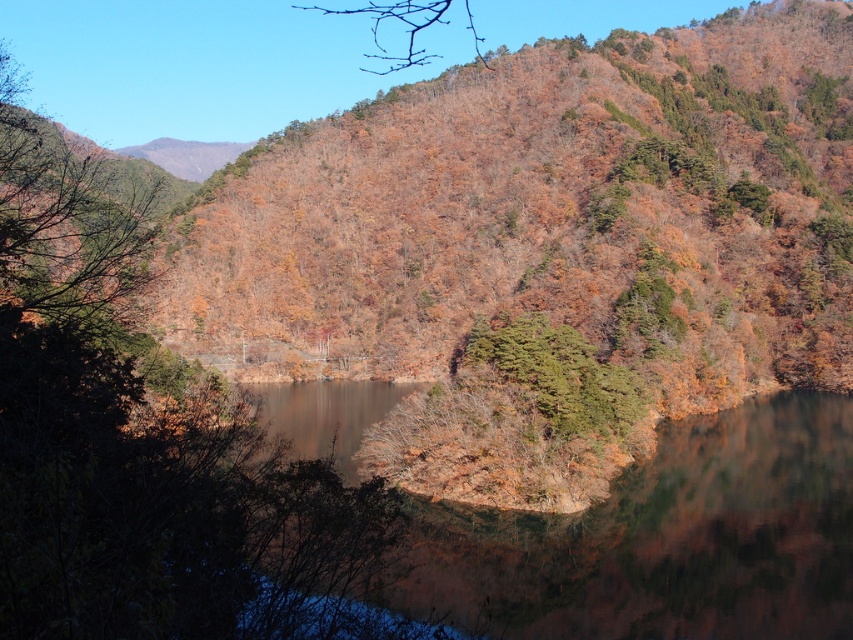
Is transparent water at center shorter than bare branches at upper center?

Yes.

Identify the location of transparent water at center. This screenshot has width=853, height=640. (663, 540).

Locate an element on the screen. This screenshot has width=853, height=640. transparent water at center is located at coordinates (663, 540).

Between green matte tree at center and bare branches at upper center, which one is positioned lower?

green matte tree at center is below.

Is point (595, 408) farther from viewer compared to point (433, 4)?

No, (595, 408) is closer to viewer.

Between point (567, 374) and point (432, 12), which one is positioned behind?

Point (432, 12)

This screenshot has height=640, width=853. In order to click on green matte tree at center in this screenshot , I will do `click(560, 374)`.

Between transparent water at center and green matte tree at center, which one appears on the right side from the viewer's perspective?

green matte tree at center

Can you confirm if transparent water at center is positioned above green matte tree at center?

Actually, transparent water at center is below green matte tree at center.

Is point (502, 618) positioned in front of point (480, 352)?

Yes, it is.

The width and height of the screenshot is (853, 640). Identify the location of transparent water at center. coord(663,540).